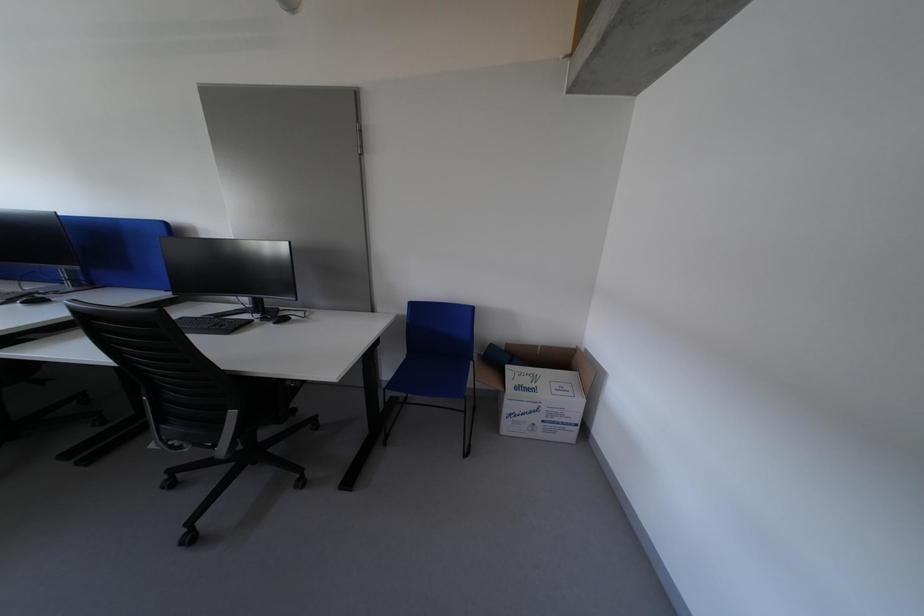
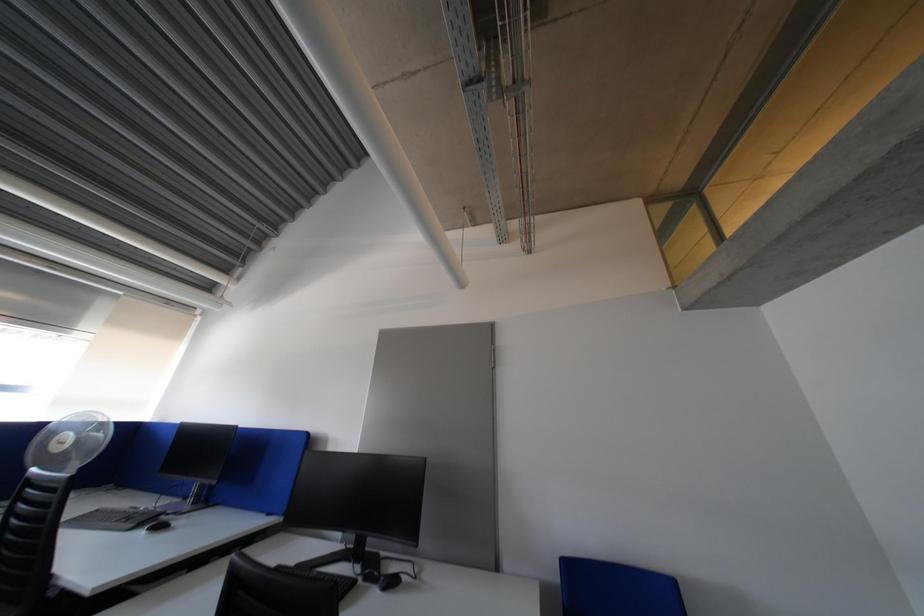
Question: The images are taken continuously from a first-person perspective. In which direction is your viewpoint rotating?

Choices:
 (A) Left
 (B) Right
 (C) Up
 (D) Down

Answer: (C)